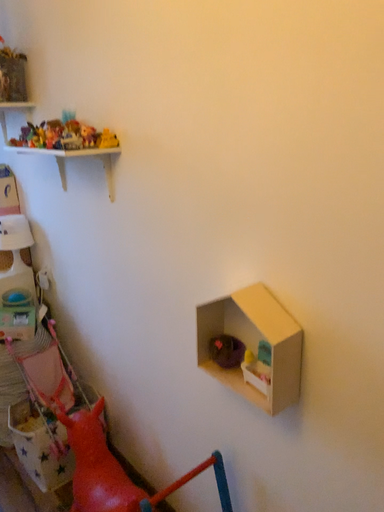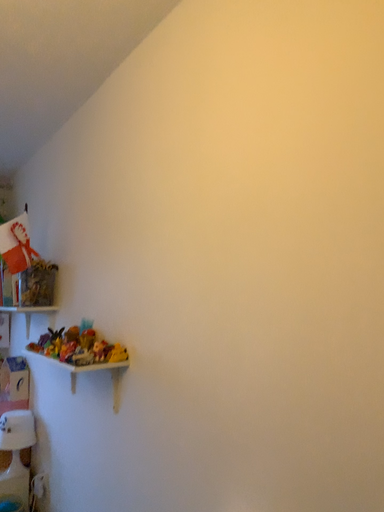
Question: Which way did the camera rotate in the video?

Choices:
 (A) rotated downward
 (B) rotated upward

Answer: (B)